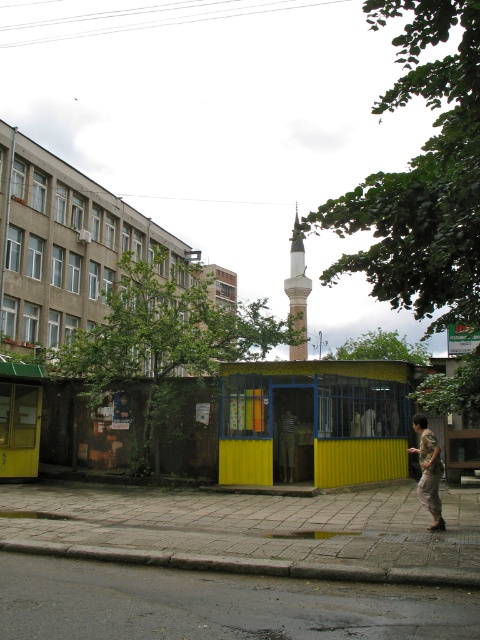
Is point (215, 544) closer to camera compared to point (424, 436)?

Yes, point (215, 544) is in front of point (424, 436).

Is concrete paving stones at lower center smaller than camouflage-patterned pants at lower right?

Incorrect, concrete paving stones at lower center is not smaller in size than camouflage-patterned pants at lower right.

This screenshot has width=480, height=640. What do you see at coordinates (249, 531) in the screenshot?
I see `concrete paving stones at lower center` at bounding box center [249, 531].

At what (x,y) coordinates should I click in order to perform the action: click on concrete paving stones at lower center. Please return your answer as a coordinate pair (x, y). The height and width of the screenshot is (640, 480). Looking at the image, I should click on (249, 531).

Identify the location of camouflage-patterned pants at lower right. Image resolution: width=480 pixels, height=640 pixels. (429, 470).

Does point (436, 500) lie behind point (294, 262)?

No.

Image resolution: width=480 pixels, height=640 pixels. What do you see at coordinates (429, 470) in the screenshot?
I see `camouflage-patterned pants at lower right` at bounding box center [429, 470].

This screenshot has height=640, width=480. I want to click on camouflage-patterned pants at lower right, so click(429, 470).

Is concrete paving stones at lower center further to camera compared to white marble minaret at center?

That is False.

Does concrete paving stones at lower center have a larger size compared to white marble minaret at center?

Actually, concrete paving stones at lower center might be smaller than white marble minaret at center.

Describe the element at coordinates (249, 531) in the screenshot. I see `concrete paving stones at lower center` at that location.

Identify the location of concrete paving stones at lower center. This screenshot has width=480, height=640. (249, 531).